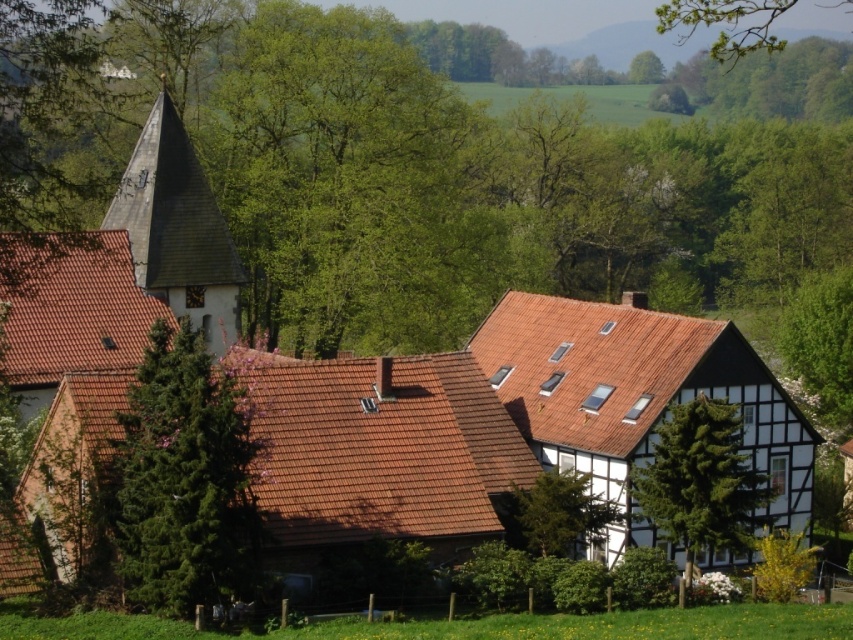
You are planning to plant a new tree in the garden. The green coniferous tree at center and the green leafy tree at upper right are already present. Which existing tree should you consider for spacing if you want to plant a small shrub nearby?

The green coniferous tree at center has a smaller size compared to the green leafy tree at upper right, so you should consider the green coniferous tree at center for spacing when planting a small shrub nearby.

What are the coordinates of the green coniferous tree at center?

The green coniferous tree at center is located at coordinates point (184,481).

You are a bird flying over the rural scene and want to land on a tree. You see the green textured tree at center and the green leafy tree at upper right. Which tree is positioned higher in the sky?

The green leafy tree at upper right is positioned higher in the sky than the green textured tree at center, as the green textured tree at center is located below it.